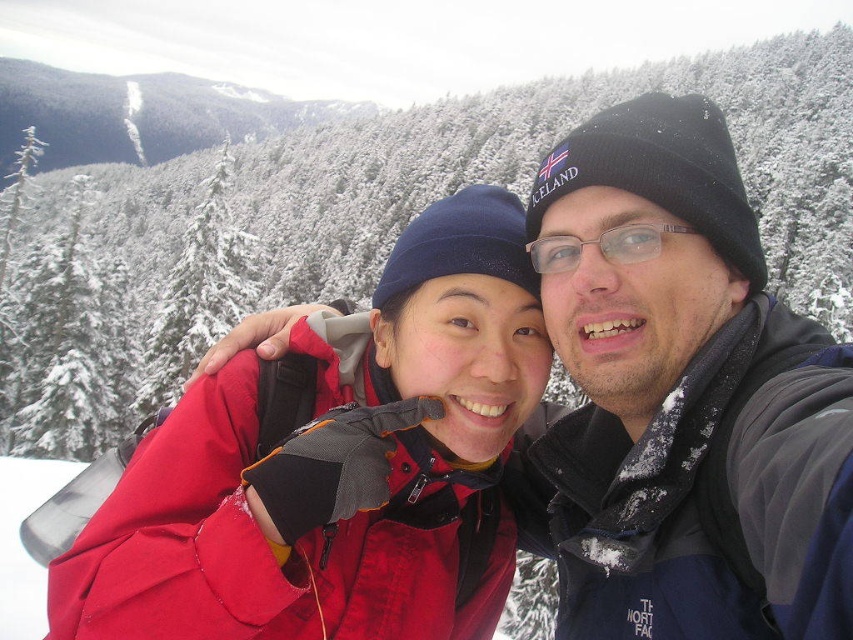
You are a photographer trying to capture the black knit hat at upper right. You need to adjust your camera to focus on the point at coordinates point (x=682, y=397). Can you confirm if the point you are focusing on is indeed the black knit hat at upper right?

Yes, the point (x=682, y=397) corresponds to the black knit hat at upper right, so focusing there will capture it.

You are standing in the snowy mountain landscape and see two points marked in the image. Which point is closer to you, point [656,99] or point [198,504]?

Point [198,504] is closer to you because it is less further to the camera than point [656,99].

You are planning to take a photo of the two people in the snowy mountain scene. You notice the black knit hat at upper right and the matte red jacket at center. Which object would you need to adjust your camera focus on first if you want to capture both clearly in the same frame?

The black knit hat at upper right is smaller in size compared to the matte red jacket at center, so you should focus on the matte red jacket at center first to ensure it is in clear view before adjusting for the smaller black knit hat at upper right.